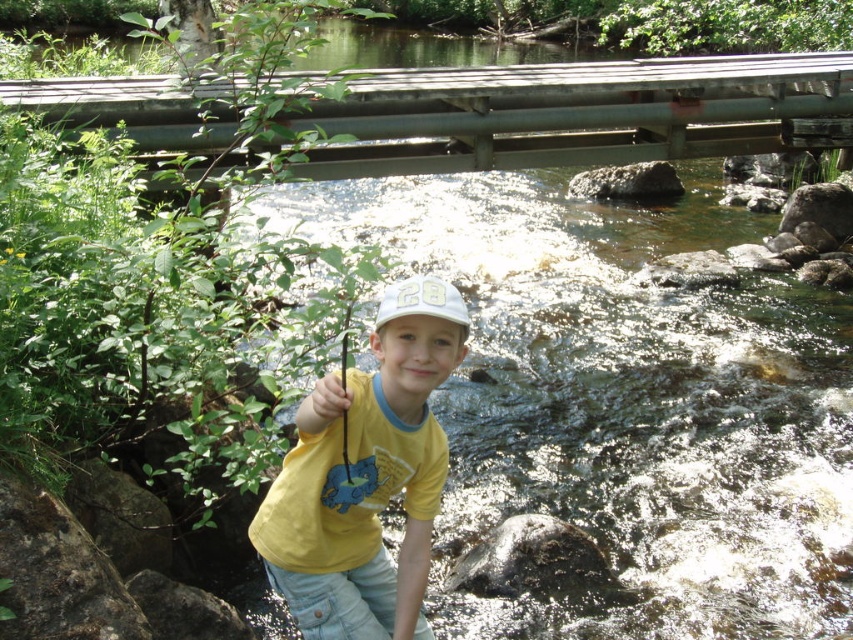
Question: Based on their relative distances, which object is farther from the wooden bridge at upper center?

Choices:
 (A) yellow cotton shirt at center
 (B) white matte baseball cap at center

Answer: (A)

Question: Which of the following is the closest to the observer?

Choices:
 (A) (683, 102)
 (B) (398, 291)
 (C) (335, 572)

Answer: (B)

Question: Which is farther from the wooden bridge at upper center?

Choices:
 (A) yellow cotton shirt at center
 (B) white matte baseball cap at center

Answer: (A)

Question: Is wooden bridge at upper center thinner than yellow cotton shirt at center?

Choices:
 (A) yes
 (B) no

Answer: (A)

Question: Can you confirm if wooden bridge at upper center is positioned to the right of white matte baseball cap at center?

Choices:
 (A) no
 (B) yes

Answer: (A)

Question: Is wooden bridge at upper center thinner than white matte baseball cap at center?

Choices:
 (A) yes
 (B) no

Answer: (B)